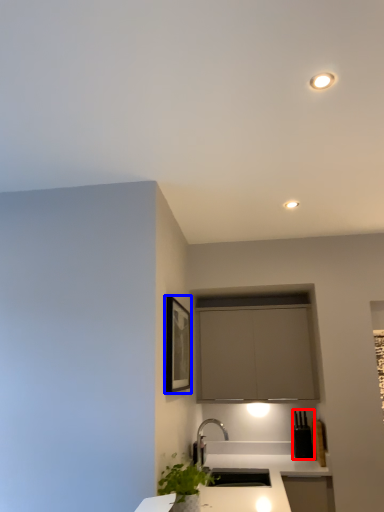
Question: Which of the following is the closest to the observer, appliance (highlighted by a red box) or picture frame (highlighted by a blue box)?

Choices:
 (A) appliance
 (B) picture frame

Answer: (B)